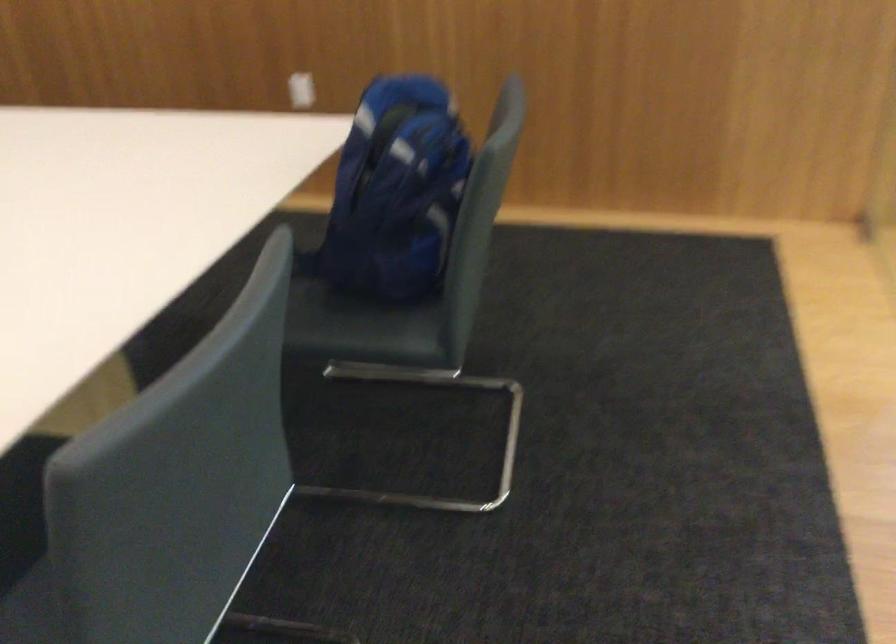
What do you see at coordinates (323, 308) in the screenshot? This screenshot has width=896, height=644. I see `the chair sitting surface` at bounding box center [323, 308].